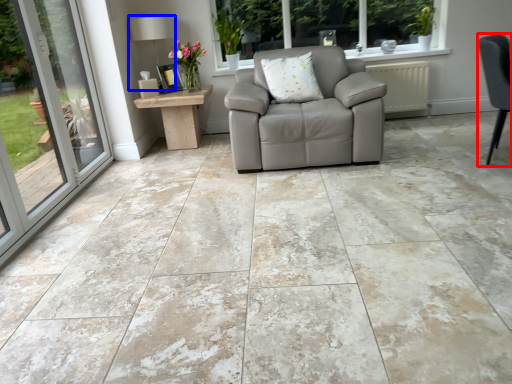
Question: Which object appears closest to the camera in this image, chair (highlighted by a red box) or lamp (highlighted by a blue box)?

Choices:
 (A) chair
 (B) lamp

Answer: (A)